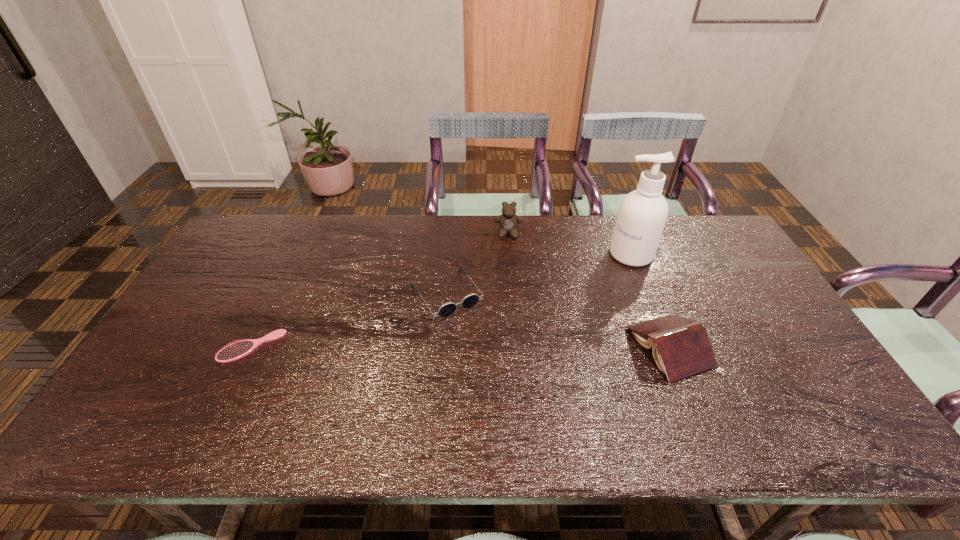
At what (x,y) coordinates should I click in order to perform the action: click on free spot on the desktop that is between the hairbrush and the book and is positioned on the front-facing side of the fourth object from right to left. Please return your answer as a coordinate pair (x, y). This screenshot has width=960, height=540. Looking at the image, I should click on (483, 347).

The width and height of the screenshot is (960, 540). What are the coordinates of `free space on the desktop that is between the leftmost object and the book and is positioned on the front label of the tallest object` in the screenshot? It's located at (515, 347).

Where is `vacant spot on the desktop that is between the hairbrush and the third shortest object and is positioned on the face of the farthest object`? The image size is (960, 540). vacant spot on the desktop that is between the hairbrush and the third shortest object and is positioned on the face of the farthest object is located at coordinates (512, 347).